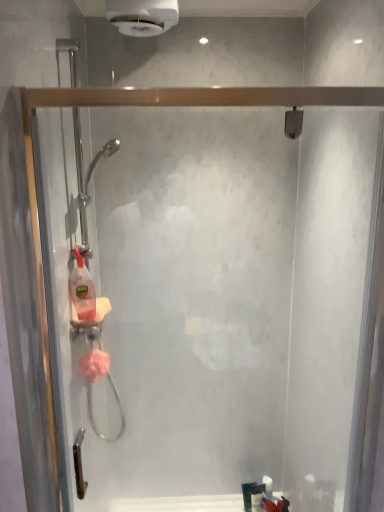
Where is `white matte light fixture at upper center`? This screenshot has width=384, height=512. white matte light fixture at upper center is located at coordinates (142, 16).

What do you see at coordinates (142, 16) in the screenshot? I see `white matte light fixture at upper center` at bounding box center [142, 16].

In order to click on white matte light fixture at upper center in this screenshot , I will do `click(142, 16)`.